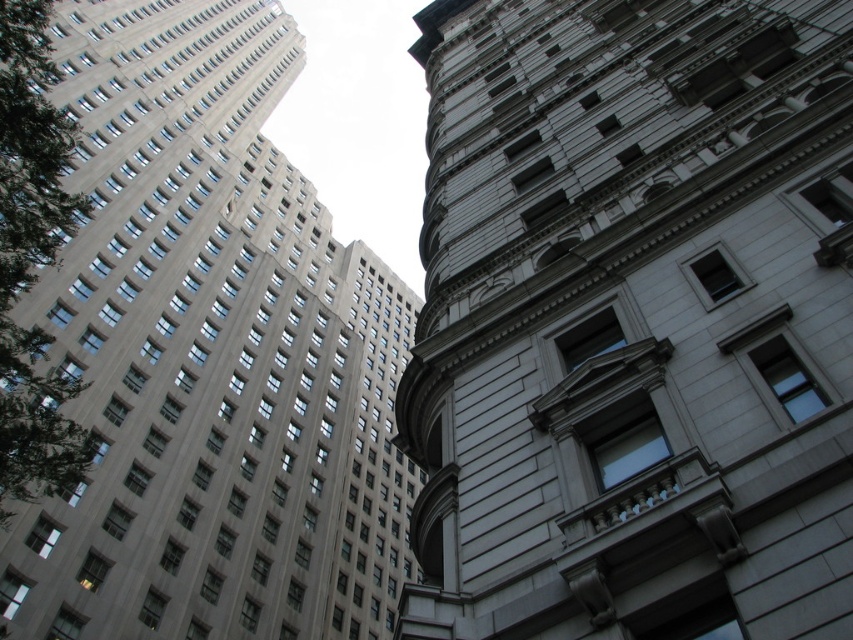
Between white stone building at center and gray stone building at upper left, which one has more height?

gray stone building at upper left

You are a GUI agent. You are given a task and a screenshot of the screen. Output one action in this format:
    pyautogui.click(x=<x>, y=<y>)
    Task: Click on the white stone building at center
    Image resolution: width=853 pixels, height=640 pixels.
    Given the screenshot: What is the action you would take?
    pyautogui.click(x=633, y=321)